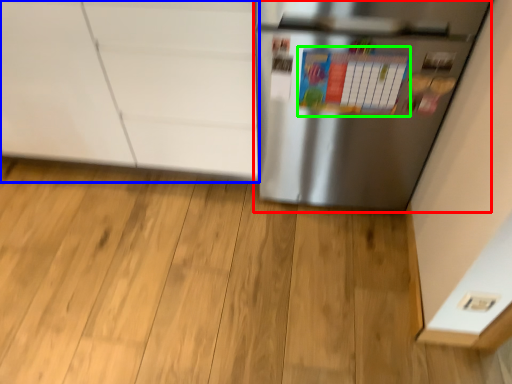
Question: Which is farther away from refrigerator (highlighted by a red box)? cabinetry (highlighted by a blue box) or bulletin board (highlighted by a green box)?

Choices:
 (A) cabinetry
 (B) bulletin board

Answer: (A)